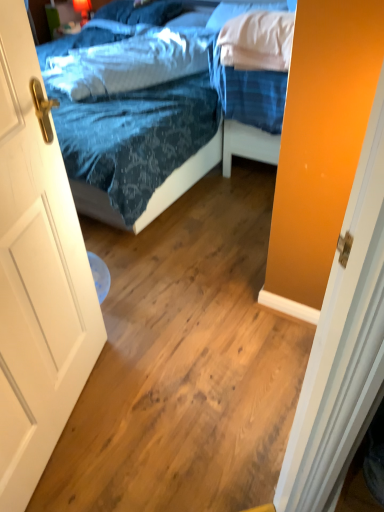
Question: From a real-world perspective, is blue fabric pillow at upper center, arranged as the third pillow when viewed from the front, physically above white wooden door at left?

Choices:
 (A) no
 (B) yes

Answer: (B)

Question: Can you confirm if blue fabric pillow at upper center, which is the 1th pillow in back-to-front order, is thinner than white wooden door at left?

Choices:
 (A) yes
 (B) no

Answer: (B)

Question: Is blue fabric pillow at upper center, which is the 1th pillow in back-to-front order, bigger than white wooden door at left?

Choices:
 (A) yes
 (B) no

Answer: (B)

Question: Can you confirm if blue fabric pillow at upper center, which is the 1th pillow in back-to-front order, is smaller than white wooden door at left?

Choices:
 (A) no
 (B) yes

Answer: (B)

Question: Considering the relative sizes of blue fabric pillow at upper center, which is the 1th pillow in back-to-front order, and white wooden door at left in the image provided, is blue fabric pillow at upper center, which is the 1th pillow in back-to-front order, shorter than white wooden door at left?

Choices:
 (A) yes
 (B) no

Answer: (A)

Question: Are blue fabric pillow at upper center, arranged as the third pillow when viewed from the front, and white wooden door at left far apart?

Choices:
 (A) no
 (B) yes

Answer: (B)

Question: Is blue textured pillow at upper center, which is counted as the 1th pillow, starting from the front, oriented towards white wooden door at left?

Choices:
 (A) no
 (B) yes

Answer: (A)

Question: Is blue textured pillow at upper center, the 3th pillow from the back, facing away from white wooden door at left?

Choices:
 (A) no
 (B) yes

Answer: (A)

Question: Considering the relative positions of blue textured pillow at upper center, the 3th pillow from the back, and white wooden door at left in the image provided, is blue textured pillow at upper center, the 3th pillow from the back, to the right of white wooden door at left from the viewer's perspective?

Choices:
 (A) no
 (B) yes

Answer: (B)

Question: Is blue textured pillow at upper center, which is counted as the 1th pillow, starting from the front, in front of white wooden door at left?

Choices:
 (A) no
 (B) yes

Answer: (A)

Question: Is blue textured pillow at upper center, which is counted as the 1th pillow, starting from the front, thinner than white wooden door at left?

Choices:
 (A) no
 (B) yes

Answer: (A)

Question: Is there a large distance between blue textured pillow at upper center, which is counted as the 1th pillow, starting from the front, and white wooden door at left?

Choices:
 (A) no
 (B) yes

Answer: (B)

Question: From the image's perspective, is blue fabric pillow at upper center, arranged as the third pillow when viewed from the front, below white soft pillow at upper right, which is the 2th pillow in front-to-back order?

Choices:
 (A) no
 (B) yes

Answer: (A)